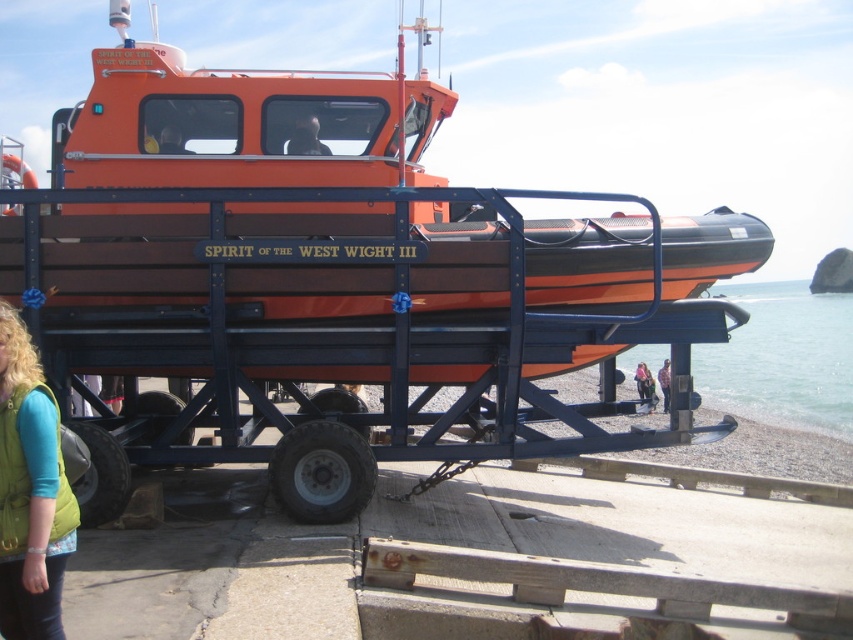
Question: Can you confirm if clear blue water at lower right is smaller than smooth brown hair at center?

Choices:
 (A) yes
 (B) no

Answer: (B)

Question: Is green fabric vest at lower left smaller than smooth brown hair at center?

Choices:
 (A) yes
 (B) no

Answer: (B)

Question: Observing the image, what is the correct spatial positioning of clear blue water at lower right in reference to light purple fleece jacket at lower right?

Choices:
 (A) above
 (B) below

Answer: (A)

Question: Which point appears closest to the camera in this image?

Choices:
 (A) (299, 154)
 (B) (79, 426)
 (C) (643, 368)

Answer: (B)

Question: Which point is closer to the camera taking this photo?

Choices:
 (A) (668, 371)
 (B) (647, 381)
 (C) (112, 336)

Answer: (C)

Question: Which point is farther from the camera taking this photo?

Choices:
 (A) (35, 232)
 (B) (49, 452)
 (C) (701, 362)
 (D) (666, 369)

Answer: (C)